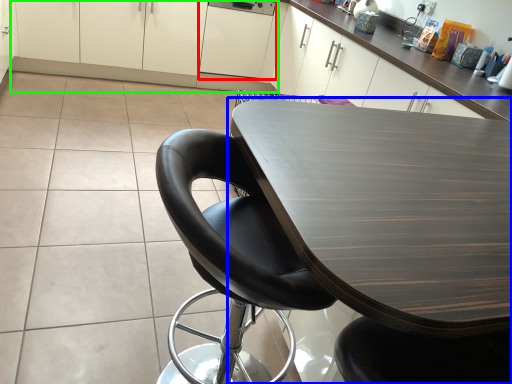
Question: Which object is the closest to the cabinetry (highlighted by a red box)? Choose among these: table (highlighted by a blue box) or cabinetry (highlighted by a green box).

Choices:
 (A) table
 (B) cabinetry

Answer: (B)